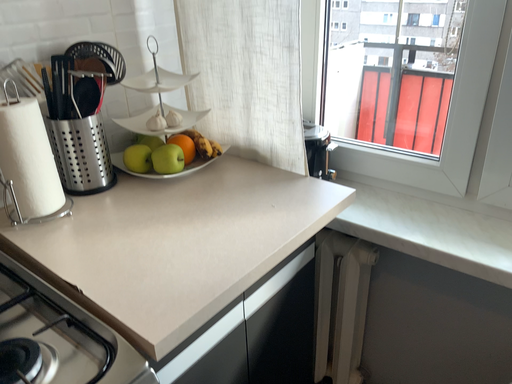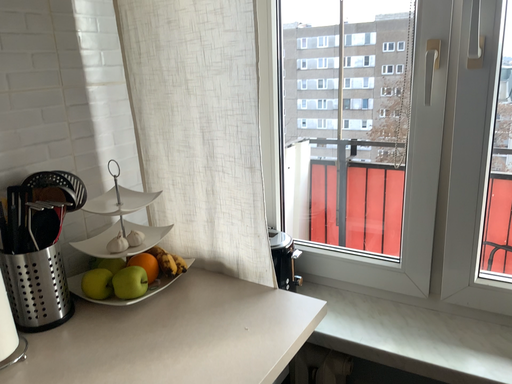
Question: How did the camera likely rotate when shooting the video?

Choices:
 (A) rotated upward
 (B) rotated downward

Answer: (A)